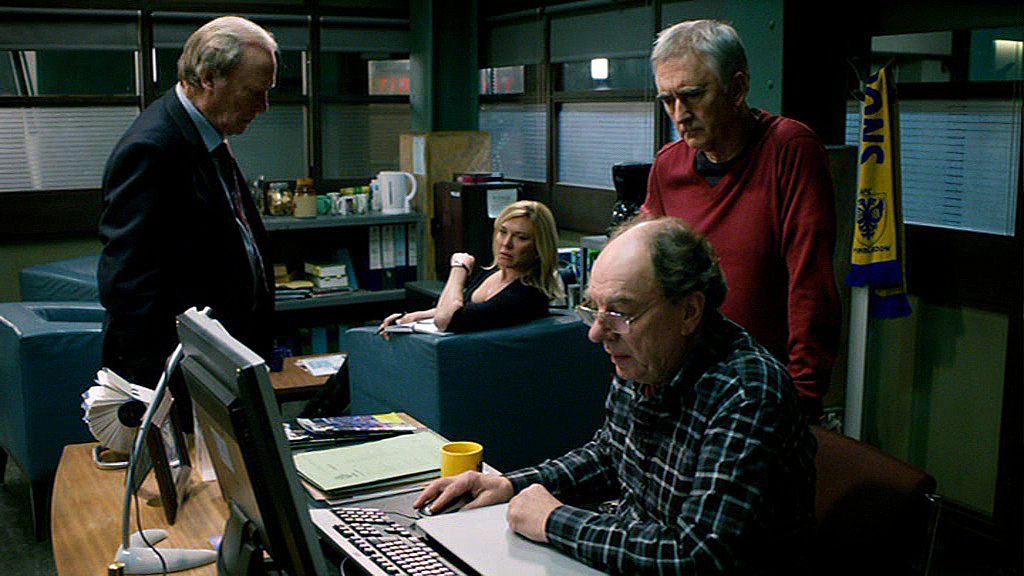
You are a GUI agent. You are given a task and a screenshot of the screen. Output one action in this format:
    pyautogui.click(x=<x>, y=<y>)
    Task: Click on the jug
    
    Given the screenshot: What is the action you would take?
    pos(393,188)